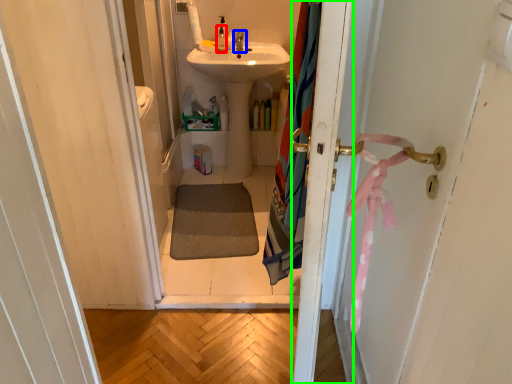
Question: Based on their relative distances, which object is farther from toiletry (highlighted by a red box)? Choose from tap (highlighted by a blue box) and screen door (highlighted by a green box).

Choices:
 (A) tap
 (B) screen door

Answer: (B)